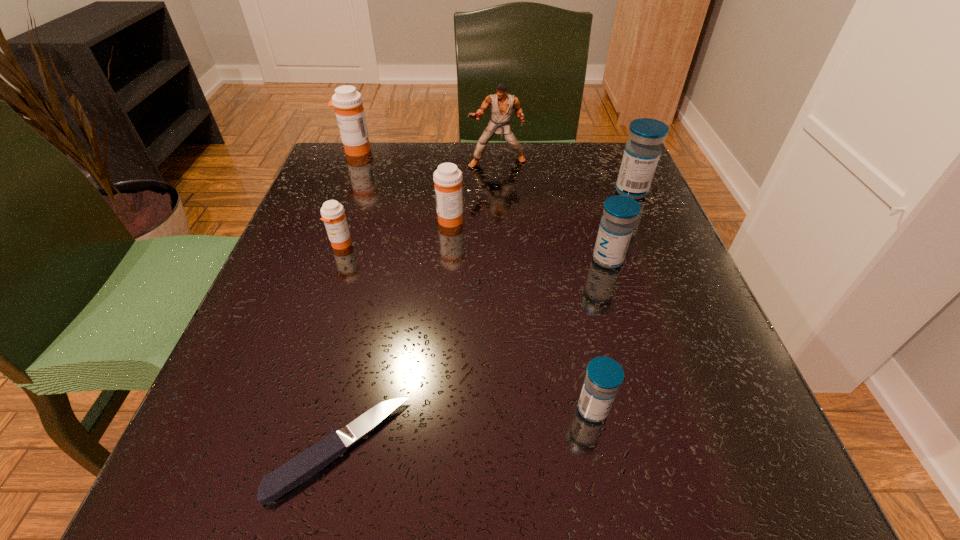
Image resolution: width=960 pixels, height=540 pixels. I want to click on free space located on the back of the smallest blue medicine, so click(576, 326).

Locate an element on the screen. This screenshot has width=960, height=540. vacant area situated on the right of the shortest object is located at coordinates (507, 449).

Locate an element on the screen. puncher positioned at the far edge is located at coordinates (502, 103).

Identify the location of object present at the near edge. Image resolution: width=960 pixels, height=540 pixels. (304, 466).

This screenshot has height=540, width=960. In order to click on steak knife located in the left edge section of the desktop in this screenshot , I will do pyautogui.click(x=304, y=466).

Locate an element on the screen. object at the far left corner is located at coordinates (349, 110).

Locate an element on the screen. This screenshot has height=540, width=960. object situated at the near left corner is located at coordinates (304, 466).

This screenshot has height=540, width=960. Identify the location of object present at the far right corner. (641, 155).

Where is `vacant point at the far edge`? The image size is (960, 540). vacant point at the far edge is located at coordinates (425, 147).

Find the location of a particular element. The image size is (960, 540). vacant space at the near edge is located at coordinates (425, 474).